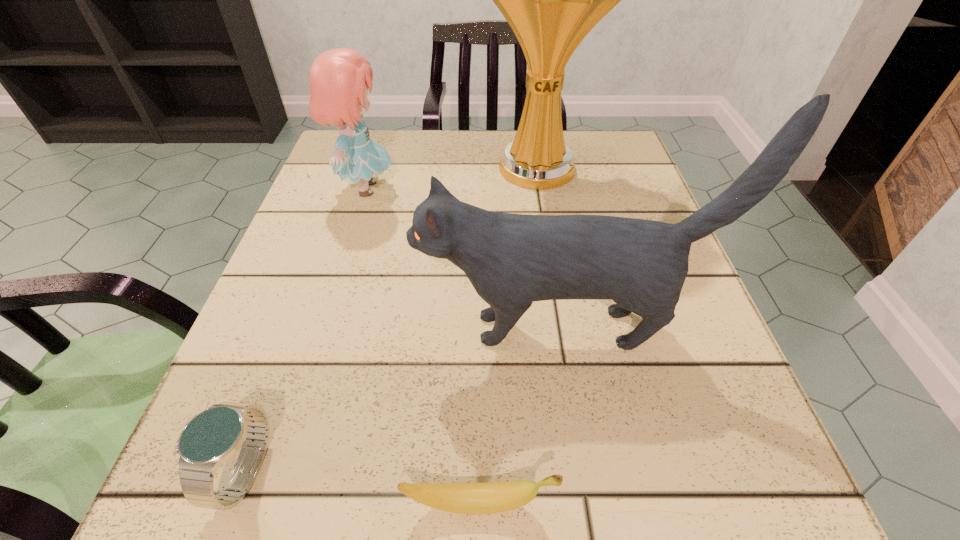
Where is `cat at the right edge`? The image size is (960, 540). cat at the right edge is located at coordinates (512, 260).

Identify the location of object at the far left corner. (340, 78).

Identify the location of object that is at the near left corner. The image size is (960, 540). (210, 438).

Identify the location of object located in the far right corner section of the desktop. (551, 0).

The height and width of the screenshot is (540, 960). In order to click on free space at the far edge in this screenshot , I will do `click(480, 156)`.

Find the location of a particular element. The width and height of the screenshot is (960, 540). vacant space at the left edge is located at coordinates (302, 440).

Image resolution: width=960 pixels, height=540 pixels. In the image, there is a desktop. Find the location of `vacant space at the right edge`. vacant space at the right edge is located at coordinates 621,329.

The height and width of the screenshot is (540, 960). Find the location of `free space at the far left corner`. free space at the far left corner is located at coordinates (387, 171).

Identify the location of unoccupied position between the trophy_cup and the watch. (392, 321).

What are the coordinates of `free spot between the third tallest object and the trophy_cup` in the screenshot? It's located at (451, 179).